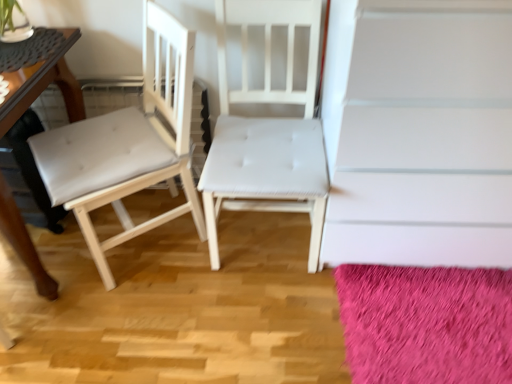
Question: Is white leather chair at left, which ranks as the second chair in right-to-left order, behind white matte stairwell at upper center?

Choices:
 (A) yes
 (B) no

Answer: (A)

Question: Is white leather chair at left, which is counted as the 1th chair, starting from the left, at the left side of white matte stairwell at upper center?

Choices:
 (A) no
 (B) yes

Answer: (B)

Question: From a real-world perspective, is white leather chair at left, which is counted as the 1th chair, starting from the left, positioned under white matte stairwell at upper center based on gravity?

Choices:
 (A) yes
 (B) no

Answer: (A)

Question: Can you confirm if white leather chair at left, which is counted as the 1th chair, starting from the left, is smaller than white matte stairwell at upper center?

Choices:
 (A) yes
 (B) no

Answer: (A)

Question: Does white leather chair at left, which is counted as the 1th chair, starting from the left, contain white matte stairwell at upper center?

Choices:
 (A) yes
 (B) no

Answer: (B)

Question: From their relative heights in the image, would you say fuzzy pink rug at lower right is taller or shorter than white matte stairwell at upper center?

Choices:
 (A) short
 (B) tall

Answer: (A)

Question: In the image, is fuzzy pink rug at lower right on the left side or the right side of white matte stairwell at upper center?

Choices:
 (A) left
 (B) right

Answer: (A)

Question: Is fuzzy pink rug at lower right in front of or behind white matte stairwell at upper center in the image?

Choices:
 (A) behind
 (B) front

Answer: (A)

Question: From a real-world perspective, relative to white matte stairwell at upper center, is fuzzy pink rug at lower right vertically above or below?

Choices:
 (A) above
 (B) below

Answer: (B)

Question: Relative to white leather chair at left, which is counted as the 1th chair, starting from the left, is wooden table at left in front or behind?

Choices:
 (A) behind
 (B) front

Answer: (B)

Question: Would you say wooden table at left is to the left or to the right of white leather chair at left, which ranks as the second chair in right-to-left order, in the picture?

Choices:
 (A) left
 (B) right

Answer: (A)

Question: Considering the positions of wooden table at left and white leather chair at left, which ranks as the second chair in right-to-left order, in the image, is wooden table at left bigger or smaller than white leather chair at left, which ranks as the second chair in right-to-left order,?

Choices:
 (A) small
 (B) big

Answer: (B)

Question: Is wooden table at left taller or shorter than white leather chair at left, which is counted as the 1th chair, starting from the left?

Choices:
 (A) short
 (B) tall

Answer: (A)

Question: From the image's perspective, is white matte stairwell at upper center positioned above or below wooden table at left?

Choices:
 (A) below
 (B) above

Answer: (B)

Question: From their relative heights in the image, would you say white matte stairwell at upper center is taller or shorter than wooden table at left?

Choices:
 (A) short
 (B) tall

Answer: (B)